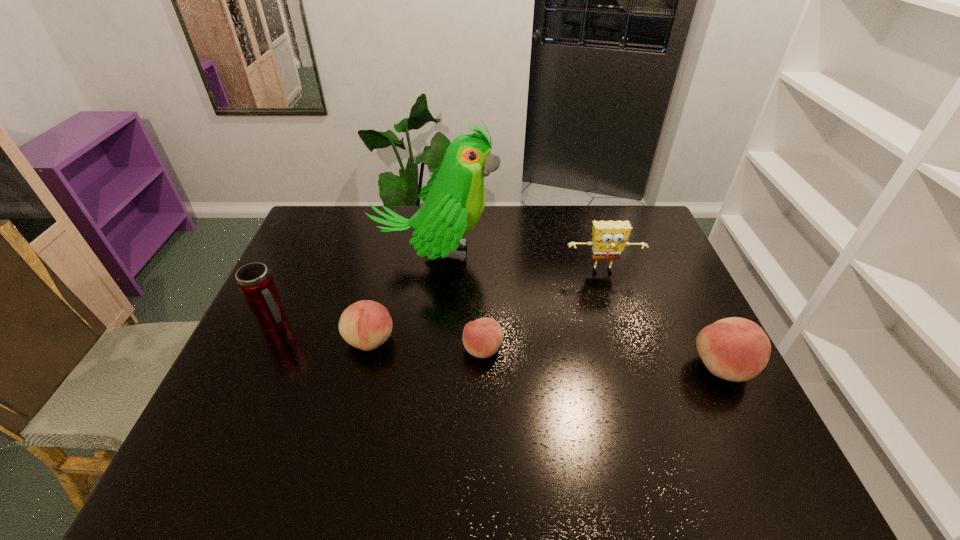
Find the location of a particular element. vacant space that satisfies the following two spatial constraints: 1. on the beak of the parakeet; 2. on the left side of the second peach from right to left is located at coordinates click(x=425, y=349).

This screenshot has height=540, width=960. What are the coordinates of `blank area in the image that satisfies the following two spatial constraints: 1. on the face of the fifth object from left to right; 2. on the side with the handle of the thermos bottle` in the screenshot? It's located at (620, 326).

Locate an element on the screen. Image resolution: width=960 pixels, height=540 pixels. vacant point that satisfies the following two spatial constraints: 1. on the side with the handle of the thermos bottle; 2. on the right side of the second peach from right to left is located at coordinates (265, 349).

I want to click on free point that satisfies the following two spatial constraints: 1. on the face of the sponge; 2. on the left side of the fourth tallest object, so click(x=633, y=367).

The height and width of the screenshot is (540, 960). What are the coordinates of `vacant region that satisfies the following two spatial constraints: 1. on the face of the sponge; 2. on the side with the handle of the leftmost object` in the screenshot? It's located at (620, 326).

Identify the location of vacant space that satisfies the following two spatial constraints: 1. on the front side of the leftmost peach; 2. on the left side of the second peach from left to right. (368, 349).